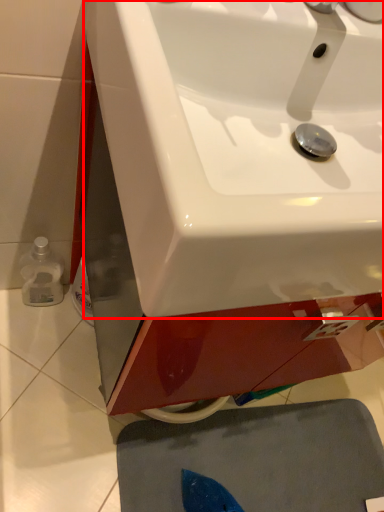
Question: From the image's perspective, where is sink (annotated by the red box) located in relation to bath mat in the image?

Choices:
 (A) above
 (B) below

Answer: (A)